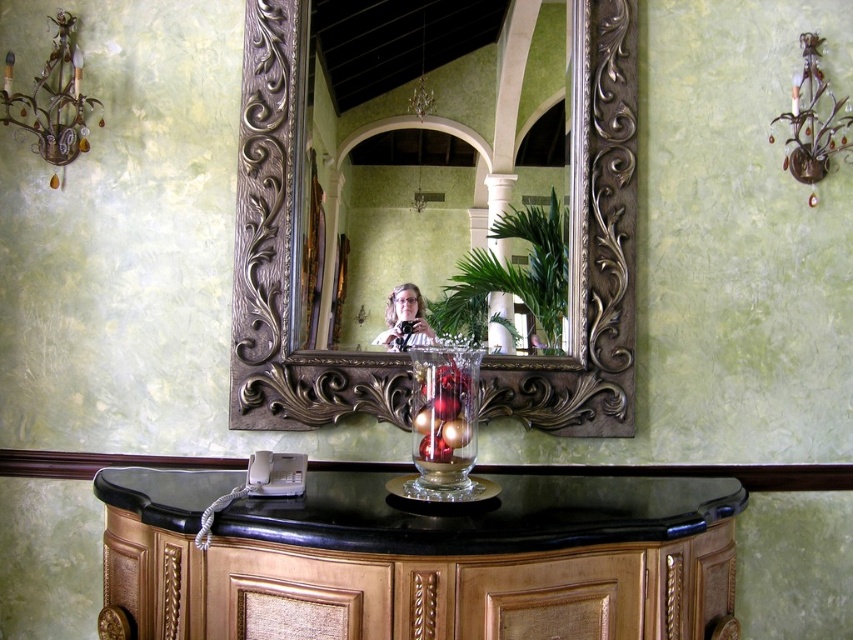
Can you confirm if gold ornate mirror at center is bigger than matte black camera at center?

Yes, gold ornate mirror at center is bigger than matte black camera at center.

Does gold ornate mirror at center appear under matte black camera at center?

No.

Which is in front, point (431, 113) or point (399, 321)?

Point (399, 321) is in front.

I want to click on gold ornate mirror at center, so click(x=436, y=163).

Which of these two, black marble vanity at lower center or gold ornate mirror at center, stands shorter?

black marble vanity at lower center

Is black marble vanity at lower center shorter than gold ornate mirror at center?

Indeed, black marble vanity at lower center has a lesser height compared to gold ornate mirror at center.

Who is more forward, (241, 508) or (498, 122)?

Positioned in front is point (241, 508).

Locate an element on the screen. The image size is (853, 640). black marble vanity at lower center is located at coordinates (421, 560).

Looking at this image, is black marble vanity at lower center positioned in front of matte black camera at center?

Yes, it is in front of matte black camera at center.

Can you confirm if black marble vanity at lower center is positioned above matte black camera at center?

No, black marble vanity at lower center is not above matte black camera at center.

Is point (514, 612) positioned after point (419, 298)?

No, it is in front of (419, 298).

What are the coordinates of `black marble vanity at lower center` in the screenshot? It's located at click(x=421, y=560).